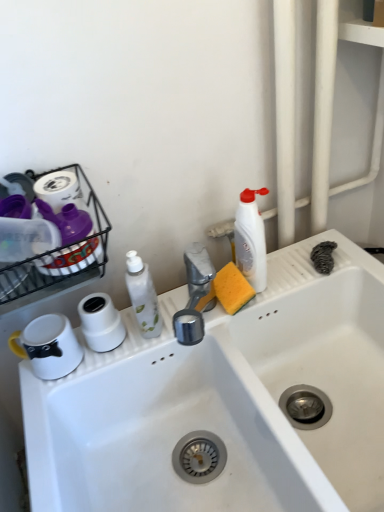
The height and width of the screenshot is (512, 384). Find the location of `free space in front of white matte toilet paper at center`. free space in front of white matte toilet paper at center is located at coordinates (74, 382).